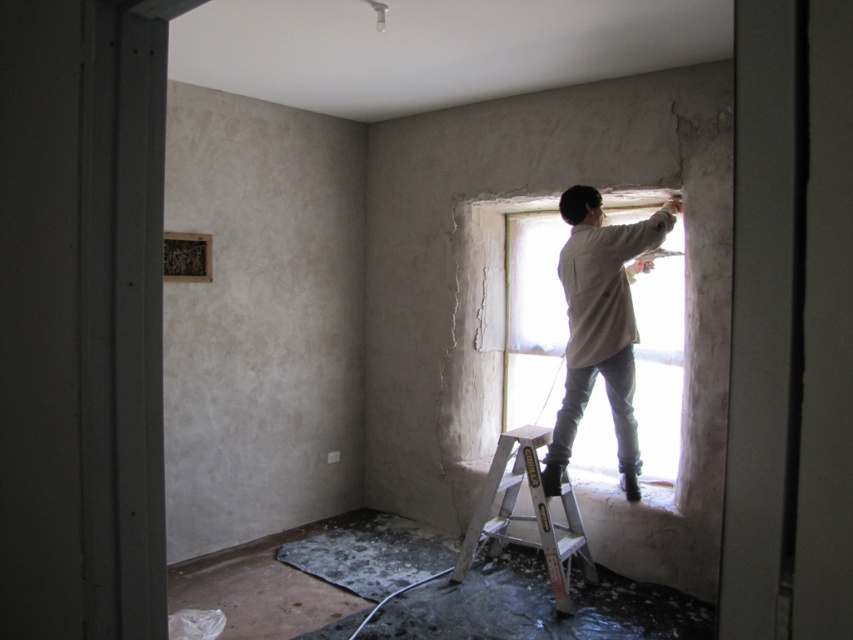
Does light brown cotton shirt at upper right have a larger size compared to silver metallic ladder at center?

Yes.

Between light brown cotton shirt at upper right and silver metallic ladder at center, which one has less height?

Standing shorter between the two is silver metallic ladder at center.

The image size is (853, 640). What are the coordinates of `light brown cotton shirt at upper right` in the screenshot? It's located at (601, 324).

Locate an element on the screen. Image resolution: width=853 pixels, height=640 pixels. light brown cotton shirt at upper right is located at coordinates (601, 324).